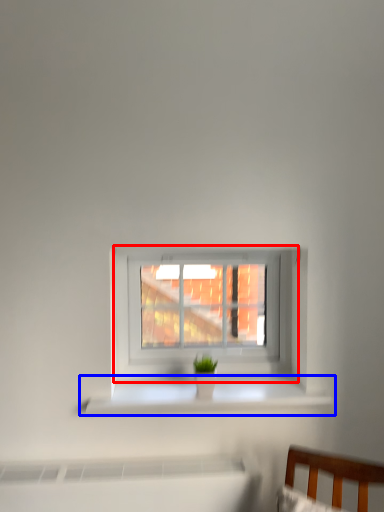
Question: Which of the following is the closest to the observer, window (highlighted by a red box) or window sill (highlighted by a blue box)?

Choices:
 (A) window
 (B) window sill

Answer: (B)